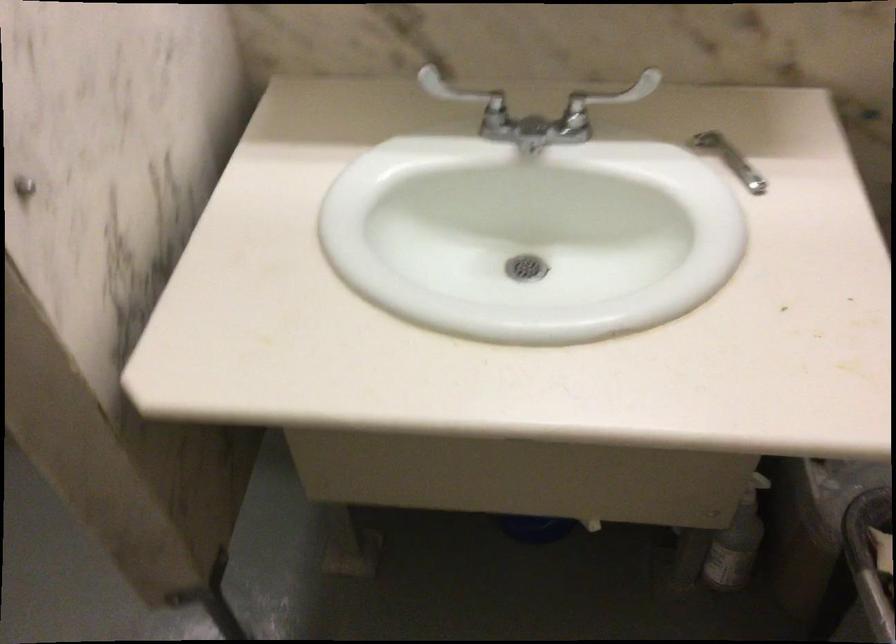
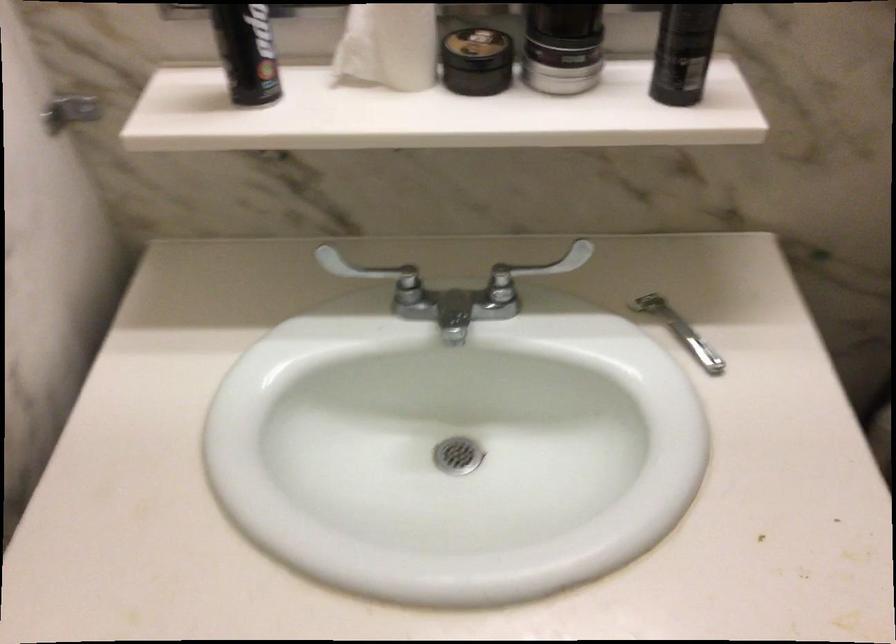
Question: The images are taken continuously from a first-person perspective. In which direction are you moving?

Choices:
 (A) Left
 (B) Right
 (C) Forward
 (D) Backward

Answer: (C)